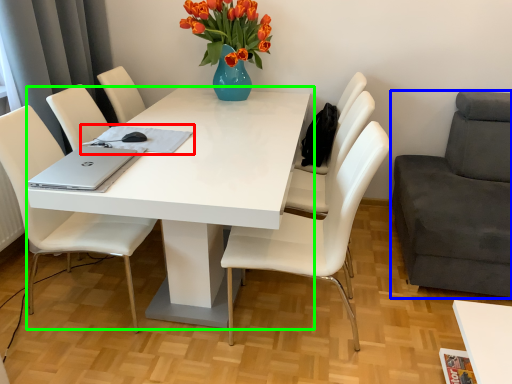
Question: Which object is the farthest from notepad (highlighted by a red box)? Choose among these: chair (highlighted by a blue box) or table (highlighted by a green box).

Choices:
 (A) chair
 (B) table

Answer: (A)